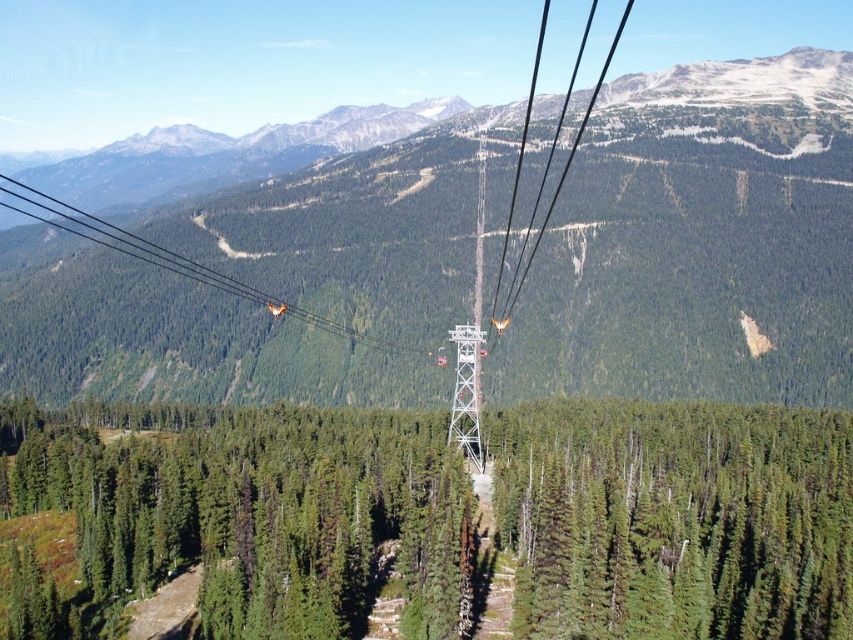
Question: Is green matte tree at center behind white metallic tower at center?

Choices:
 (A) no
 (B) yes

Answer: (A)

Question: Can you confirm if green matte pine forest at center is thinner than green matte tree at center?

Choices:
 (A) no
 (B) yes

Answer: (A)

Question: Which point is farther to the camera?

Choices:
 (A) (730, 589)
 (B) (480, 250)

Answer: (B)

Question: Among these objects, which one is farthest from the camera?

Choices:
 (A) white metallic tower at center
 (B) green matte pine forest at center
 (C) green matte tree at center

Answer: (A)

Question: Among these objects, which one is nearest to the camera?

Choices:
 (A) white metallic tower at center
 (B) green matte tree at center

Answer: (B)

Question: Does green matte tree at center come behind white metallic tower at center?

Choices:
 (A) yes
 (B) no

Answer: (B)